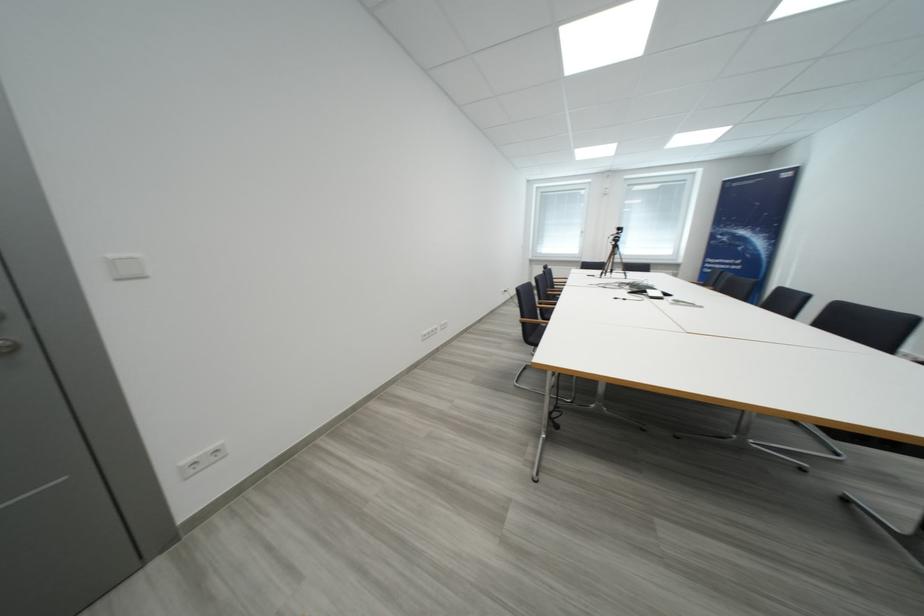
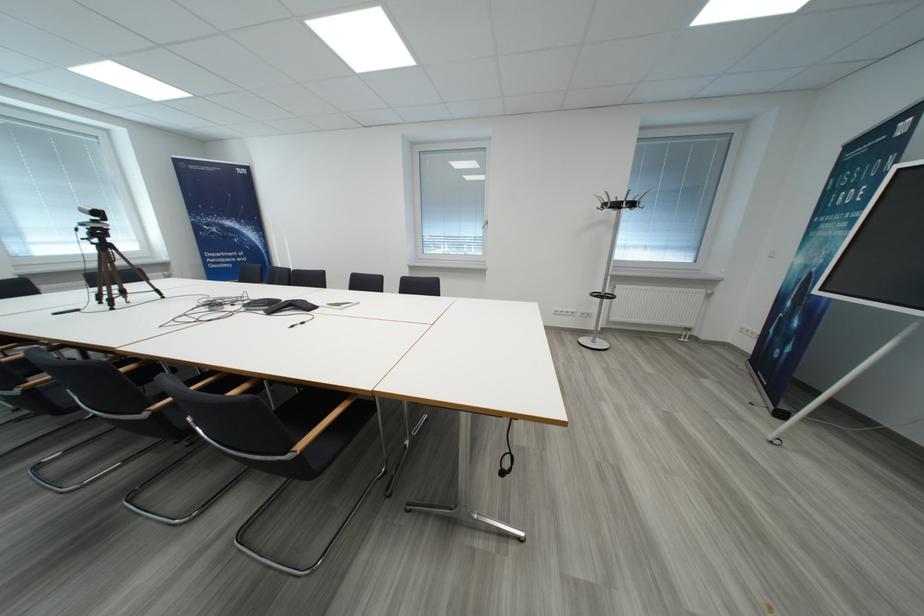
Locate, in the second image, the point that corresponds to pixel 624 241 in the first image.

(106, 236)